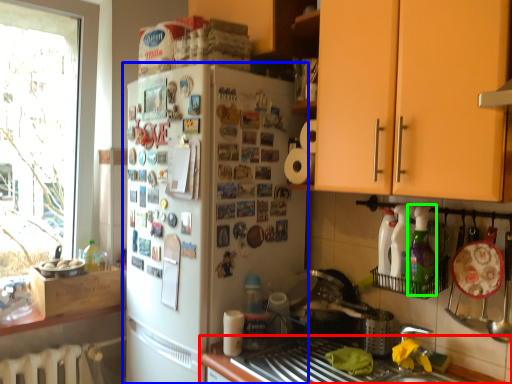
Question: Estimate the real-world distances between objects in this image. Which object is farther from countertop (highlighted by a red box), refrigerator (highlighted by a blue box) or bottle (highlighted by a green box)?

Choices:
 (A) refrigerator
 (B) bottle

Answer: (B)